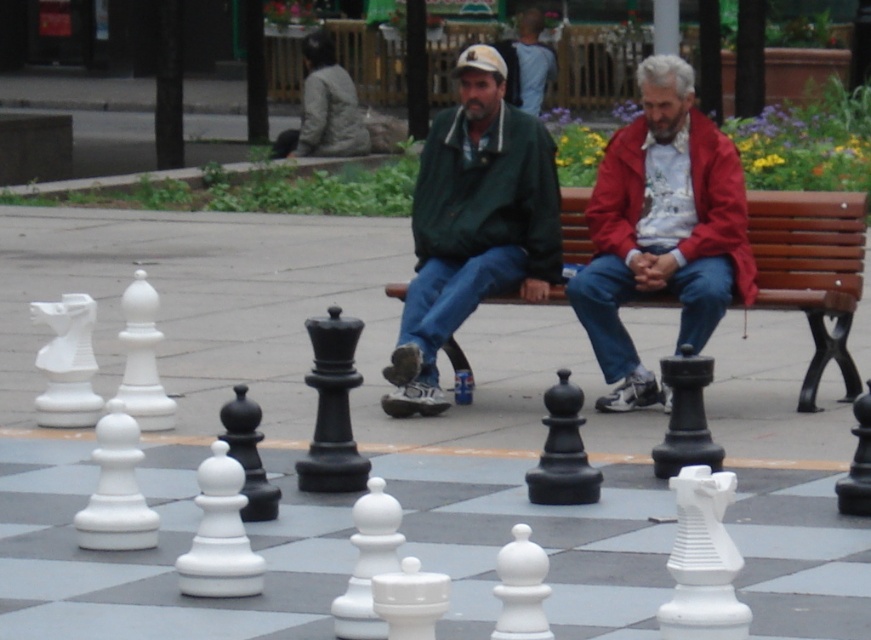
You are a tailor who needs to determine which jacket requires more fabric to make between the red matte jacket at center and the green matte jacket at center. Based on the image, which one would you choose?

The red matte jacket at center requires more fabric because its width is larger than the green matte jacket at center.

You are a photographer standing at the edge of the park. You notice a red matte jacket at center and a beech wood bench at center. If you want to take a photo that includes both objects, which one should you position closer to the camera to ensure both are fully visible in the frame?

To ensure both the red matte jacket at center and the beech wood bench at center are fully visible in the frame, you should position the red matte jacket at center closer to the camera since it is in front of the beech wood bench at center.

Based on the photo, you are a photographer standing in the park and want to capture a photo of the green matte jacket at center and the beech wood bench at center. If you want to ensure both are fully visible in the frame, which object should you focus on first to avoid cropping?

The green matte jacket at center is taller than the beech wood bench at center, so you should focus on the green matte jacket at center first to ensure it fits within the frame without being cut off.